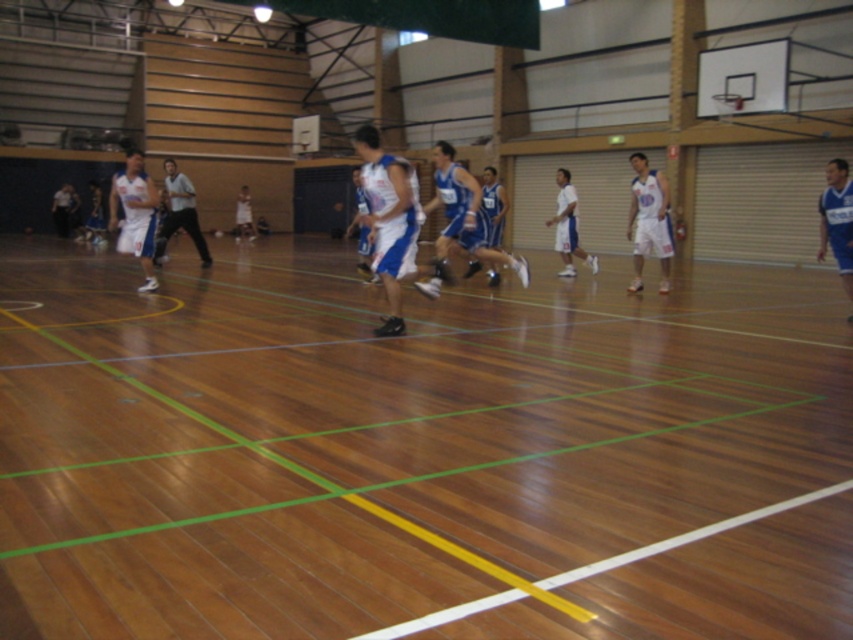
Question: Which point is closer to the camera taking this photo?

Choices:
 (A) pos(492,250)
 (B) pos(148,230)

Answer: (A)

Question: In this image, where is white/blue jersey at center located relative to white jersey at right?

Choices:
 (A) above
 (B) below

Answer: (A)

Question: Can you confirm if blue jersey shorts at center is thinner than white matte basketball player at center?

Choices:
 (A) yes
 (B) no

Answer: (A)

Question: Which of the following is the closest to the observer?

Choices:
 (A) matte black shorts at center
 (B) white/blue jersey at center
 (C) white jersey at right

Answer: (B)

Question: Does white matte basketball player at center come in front of matte black shorts at center?

Choices:
 (A) no
 (B) yes

Answer: (A)

Question: Which object is positioned closest to the white/blue jersey at center?

Choices:
 (A) matte black shorts at center
 (B) white matte basketball player at center
 (C) blue jersey shorts at center

Answer: (C)